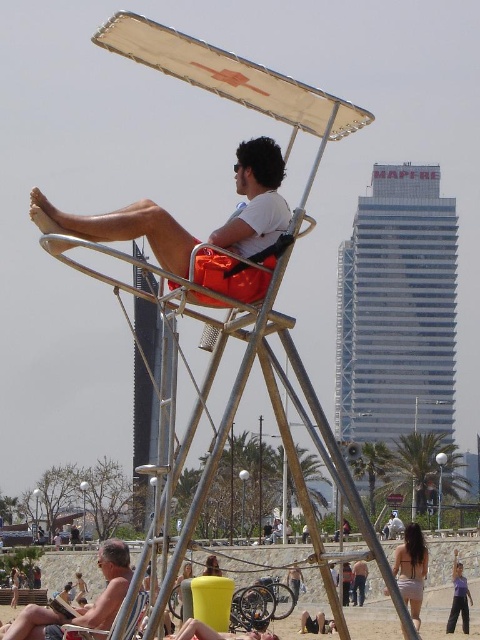
Question: Is matte orange life preserver at center further to the viewer compared to metallic silver chair at center?

Choices:
 (A) no
 (B) yes

Answer: (A)

Question: Estimate the real-world distances between objects in this image. Which object is farther from the smooth black surfboard at center?

Choices:
 (A) matte orange life preserver at center
 (B) orange fabric lifeguard chair at center
 (C) light brown fabric bikini at lower right
 (D) orange fabric life guard chair at center

Answer: (A)

Question: Which point is closer to the camera?

Choices:
 (A) (130, 618)
 (B) (356, 564)

Answer: (A)

Question: Is orange fabric lifeguard chair at center thinner than white cotton shirt at center?

Choices:
 (A) yes
 (B) no

Answer: (B)

Question: Which of the following is the farthest from the observer?

Choices:
 (A) light brown fabric bikini at lower right
 (B) matte orange shorts at center
 (C) orange fabric lifeguard chair at center
 (D) smooth black surfboard at center

Answer: (D)

Question: Does orange fabric life guard chair at center appear on the left side of white cotton shirt at center?

Choices:
 (A) yes
 (B) no

Answer: (A)